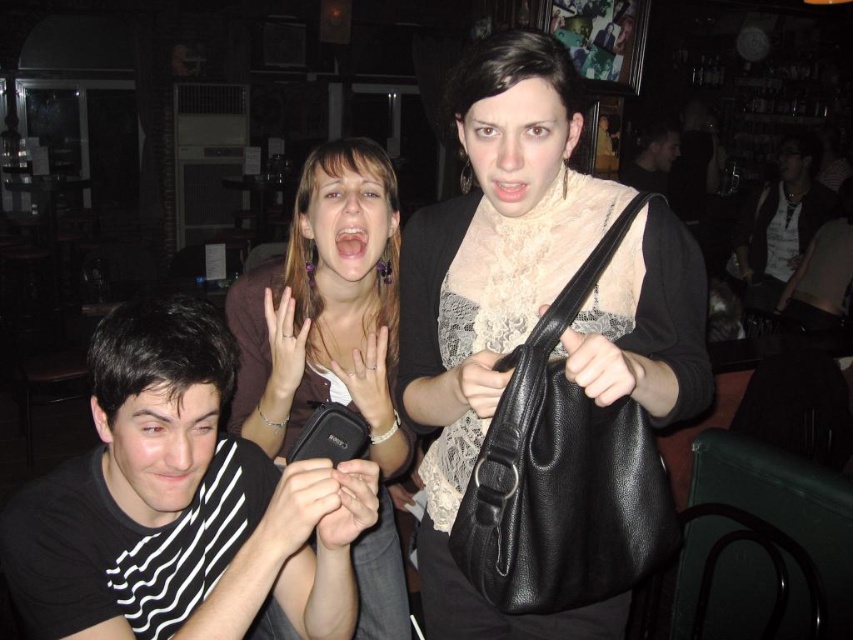
Question: Is black leather handbag at center closer to camera compared to dark brown leather jacket at right?

Choices:
 (A) yes
 (B) no

Answer: (A)

Question: Which point is closer to the camera?

Choices:
 (A) black striped shirt at lower left
 (B) matte black bag at upper center
 (C) black leather handbag at center

Answer: (C)

Question: Is black leather handbag at center to the left of matte black bag at upper center from the viewer's perspective?

Choices:
 (A) yes
 (B) no

Answer: (A)

Question: Observing the image, what is the correct spatial positioning of black leather handbag at center in reference to matte brown hair at center?

Choices:
 (A) below
 (B) above

Answer: (B)

Question: Among these points, which one is nearest to the camera?

Choices:
 (A) (334, 413)
 (B) (334, 369)
 (C) (645, 154)

Answer: (A)

Question: Which point is farther from the camera taking this photo?

Choices:
 (A) (807, 148)
 (B) (659, 168)
 (C) (340, 445)

Answer: (A)